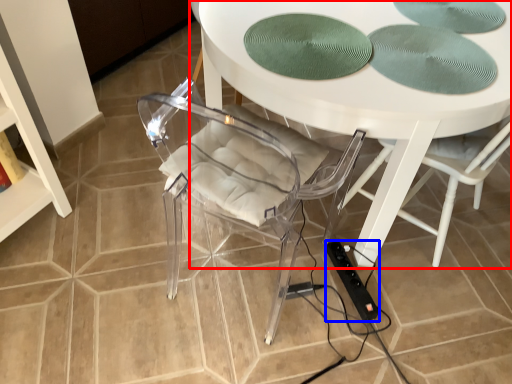
Question: Which object appears closest to the camera in this image, table (highlighted by a red box) or extension cord (highlighted by a blue box)?

Choices:
 (A) table
 (B) extension cord

Answer: (A)